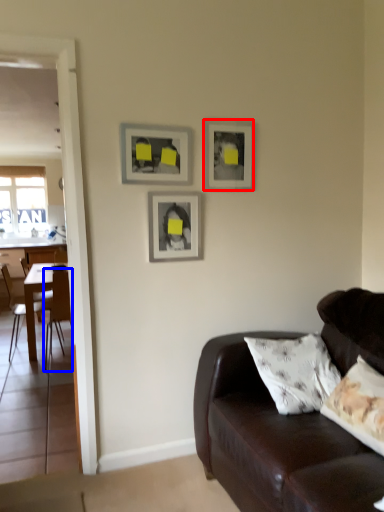
Question: Which of the following is the farthest to the observer, picture frame (highlighted by a red box) or chair (highlighted by a blue box)?

Choices:
 (A) picture frame
 (B) chair

Answer: (B)